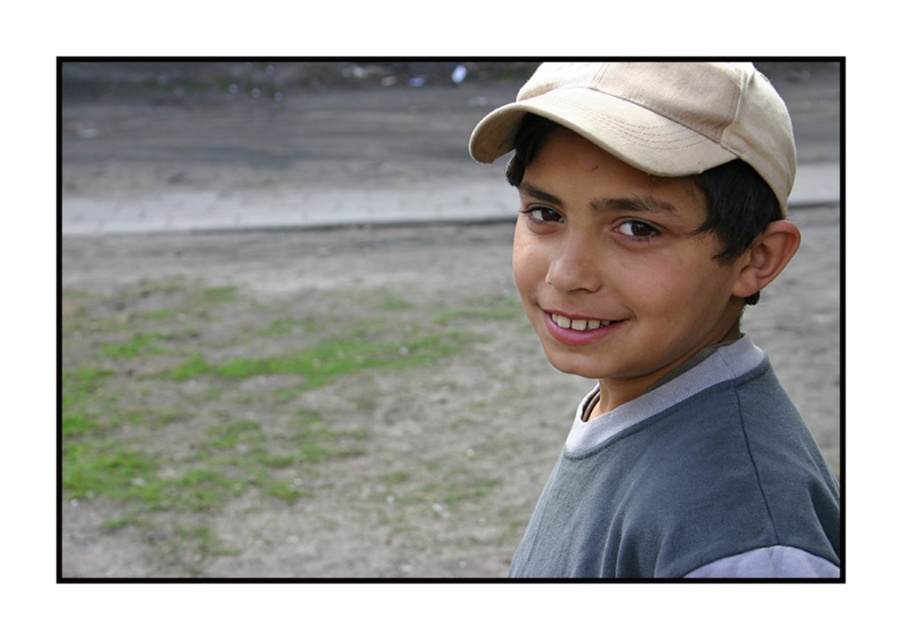
Question: Among these points, which one is nearest to the camera?

Choices:
 (A) (509, 570)
 (B) (655, 140)

Answer: (B)

Question: Is matte gray shirt at center above beige fabric baseball cap at upper right?

Choices:
 (A) yes
 (B) no

Answer: (B)

Question: From the image, what is the correct spatial relationship of matte gray shirt at center in relation to beige fabric baseball cap at upper right?

Choices:
 (A) right
 (B) left

Answer: (A)

Question: Is the position of matte gray shirt at center more distant than that of beige fabric baseball cap at upper right?

Choices:
 (A) yes
 (B) no

Answer: (B)

Question: Which point is closer to the camera taking this photo?

Choices:
 (A) (720, 120)
 (B) (661, 570)

Answer: (B)